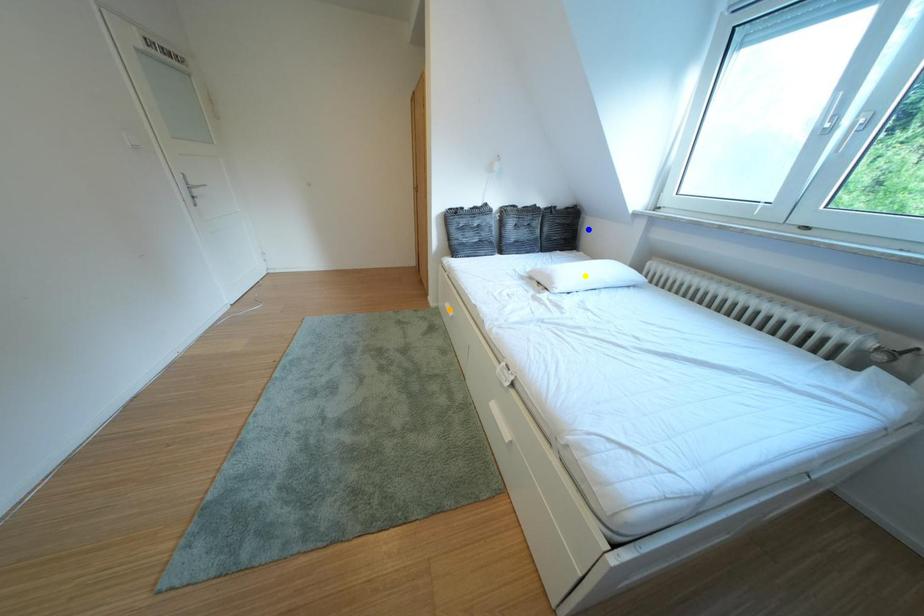
Order these from nearest to farthest:
blue point
orange point
yellow point

yellow point
orange point
blue point